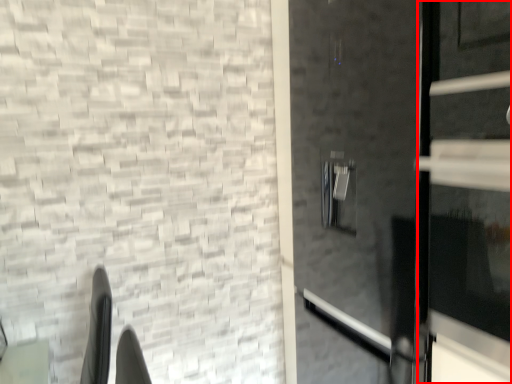
Question: From the image's perspective, where is door (annotated by the red box) located relative to door?

Choices:
 (A) above
 (B) below

Answer: (A)